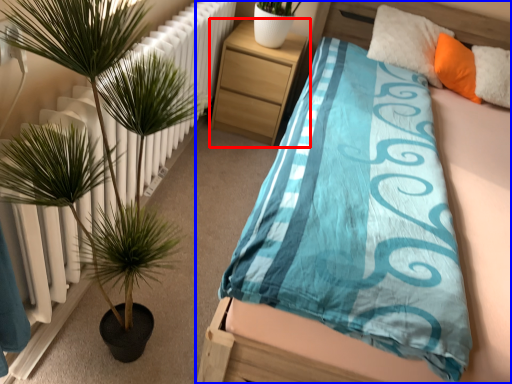
Question: Which object appears closest to the camera in this image, nightstand (highlighted by a red box) or bed (highlighted by a blue box)?

Choices:
 (A) nightstand
 (B) bed

Answer: (B)